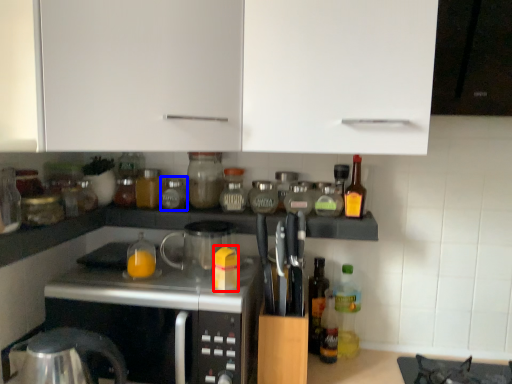
Question: Among these objects, which one is farthest to the camera, orange juice (highlighted by a red box) or bottle (highlighted by a blue box)?

Choices:
 (A) orange juice
 (B) bottle

Answer: (B)